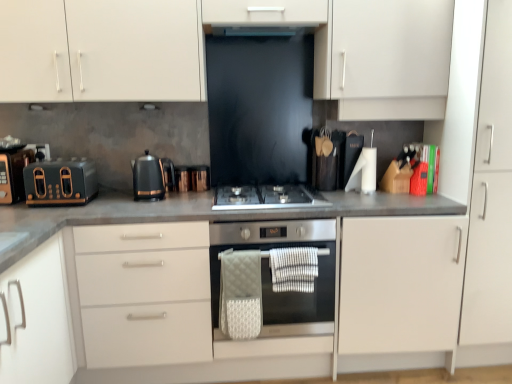
Question: Is satin silver gas stove at center bigger or smaller than matte black toaster at left, the 3th appliance positioned from the right?

Choices:
 (A) big
 (B) small

Answer: (B)

Question: From a real-world perspective, is satin silver gas stove at center physically located above or below matte black toaster at left, the 1th appliance from the left?

Choices:
 (A) below
 (B) above

Answer: (A)

Question: Considering the real-world distances, which object is farthest from the white textured hand towel at center, which appears as the second hand towel when viewed from the left?

Choices:
 (A) white matte cabinet at upper center, acting as the second cabinetry starting from the bottom
 (B) white matte cabinet at left, marked as the 2th cabinetry in a top-to-bottom arrangement
 (C) white quilted hand towel at center, placed as the first hand towel when sorted from left to right
 (D) black metallic kettle at center, positioned as the first kitchen appliance in right-to-left order
 (E) satin silver gas stove at center

Answer: (A)

Question: Which object is positioned closest to the white matte cabinet at right?

Choices:
 (A) stainless steel oven at center
 (B) black metallic kettle at center, positioned as the first kitchen appliance in right-to-left order
 (C) satin silver gas stove at center
 (D) white textured hand towel at center, placed as the first hand towel when sorted from right to left
 (E) white quilted hand towel at center, placed as the first hand towel when sorted from left to right

Answer: (A)